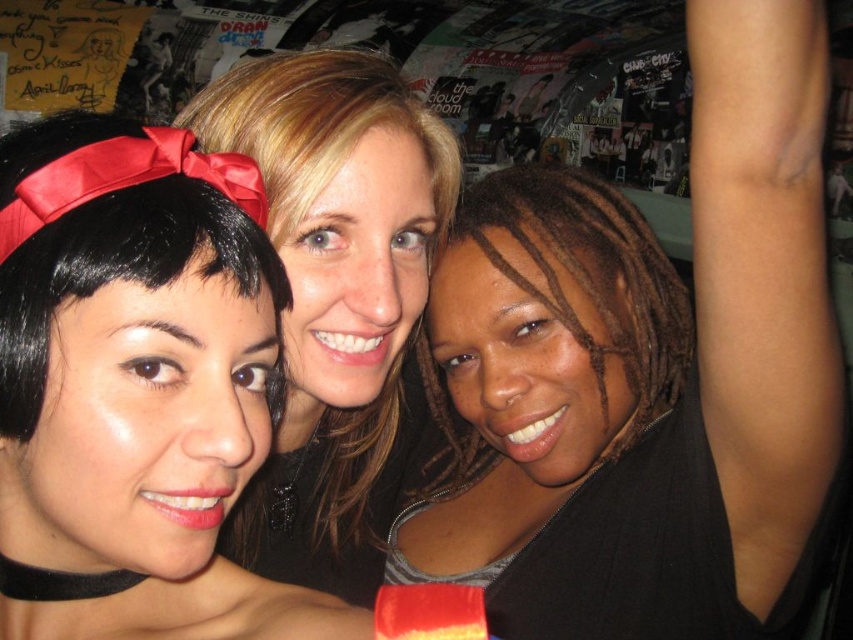
Question: Where is black matte hair at upper center located in relation to black hair at center in the image?

Choices:
 (A) right
 (B) left

Answer: (A)

Question: In this image, where is black satin headband at left located relative to black hair at center?

Choices:
 (A) above
 (B) below

Answer: (B)

Question: Is black satin headband at left wider than black hair at center?

Choices:
 (A) no
 (B) yes

Answer: (A)

Question: Which object appears closest to the camera in this image?

Choices:
 (A) black satin headband at left
 (B) black hair at center

Answer: (A)

Question: Which of the following is the closest to the observer?

Choices:
 (A) black satin headband at left
 (B) black hair at center
 (C) black matte hair at upper center

Answer: (A)

Question: Based on their relative distances, which object is farther from the black hair at center?

Choices:
 (A) black satin headband at left
 (B) black matte hair at upper center

Answer: (A)